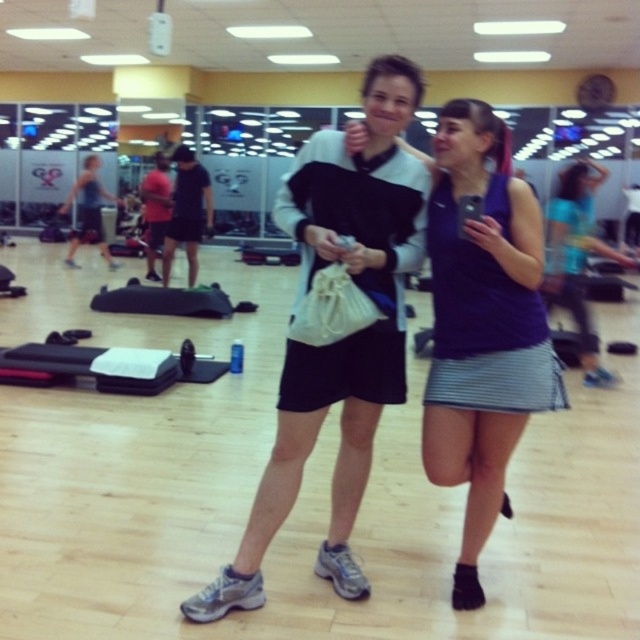
Is white matte jacket at center above blue jersey at center?

Indeed, white matte jacket at center is positioned over blue jersey at center.

From the picture: Which of these two, white matte jacket at center or blue jersey at center, stands taller?

Standing taller between the two is white matte jacket at center.

The height and width of the screenshot is (640, 640). I want to click on white matte jacket at center, so click(x=340, y=339).

Can you confirm if white matte jacket at center is bigger than purple fabric tank top at center?

Incorrect, white matte jacket at center is not larger than purple fabric tank top at center.

Can you confirm if white matte jacket at center is shorter than purple fabric tank top at center?

Correct, white matte jacket at center is not as tall as purple fabric tank top at center.

Is point (312, 234) closer to viewer compared to point (579, 170)?

Yes.

Find the location of a particular element. white matte jacket at center is located at coordinates (340, 339).

Between blue jersey at center and purple fabric tank top at center, which one has less height?

blue jersey at center

Between blue jersey at center and purple fabric tank top at center, which one has more height?

With more height is purple fabric tank top at center.

You are a GUI agent. You are given a task and a screenshot of the screen. Output one action in this format:
    pyautogui.click(x=<x>, y=<y>)
    Task: Click on the blue jersey at center
    
    Given the screenshot: What is the action you would take?
    pyautogui.click(x=483, y=324)